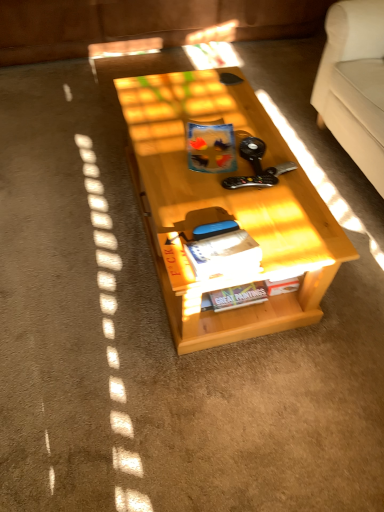
The width and height of the screenshot is (384, 512). I want to click on free space behind hardcover book at center, which is the second book from bottom to top, so click(x=215, y=204).